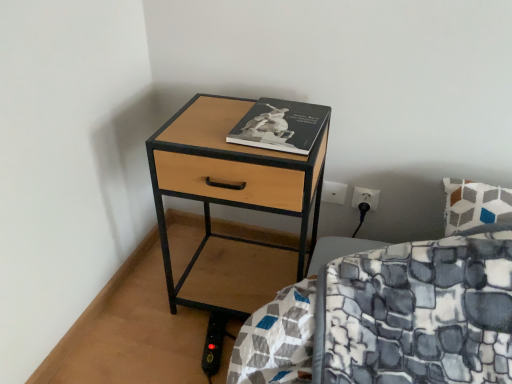
Question: From the image's perspective, does woodenmaterial/texturenightstand at lower left appear higher than black matte book at center?

Choices:
 (A) yes
 (B) no

Answer: (B)

Question: Considering the relative positions of woodenmaterial/texturenightstand at lower left and black matte book at center in the image provided, is woodenmaterial/texturenightstand at lower left to the left of black matte book at center from the viewer's perspective?

Choices:
 (A) no
 (B) yes

Answer: (B)

Question: Can you confirm if woodenmaterial/texturenightstand at lower left is bigger than black matte book at center?

Choices:
 (A) yes
 (B) no

Answer: (A)

Question: Would you consider woodenmaterial/texturenightstand at lower left to be distant from black matte book at center?

Choices:
 (A) yes
 (B) no

Answer: (B)

Question: From the image's perspective, does woodenmaterial/texturenightstand at lower left appear lower than black matte book at center?

Choices:
 (A) no
 (B) yes

Answer: (B)

Question: Is woodenmaterial/texturenightstand at lower left aimed at black matte book at center?

Choices:
 (A) no
 (B) yes

Answer: (A)

Question: Would you say black matte book at center is a long distance from woodenmaterial/texturenightstand at lower left?

Choices:
 (A) no
 (B) yes

Answer: (A)

Question: Can you confirm if black matte book at center is positioned to the left of woodenmaterial/texturenightstand at lower left?

Choices:
 (A) no
 (B) yes

Answer: (A)

Question: Does black matte book at center have a lesser height compared to woodenmaterial/texturenightstand at lower left?

Choices:
 (A) no
 (B) yes

Answer: (B)

Question: Can you confirm if black matte book at center is thinner than woodenmaterial/texturenightstand at lower left?

Choices:
 (A) yes
 (B) no

Answer: (A)

Question: Is black matte book at center in front of woodenmaterial/texturenightstand at lower left?

Choices:
 (A) yes
 (B) no

Answer: (B)

Question: Does black matte book at center lie behind woodenmaterial/texturenightstand at lower left?

Choices:
 (A) no
 (B) yes

Answer: (B)

Question: From the image's perspective, is black matte book at center located above or below woodenmaterial/texturenightstand at lower left?

Choices:
 (A) above
 (B) below

Answer: (A)